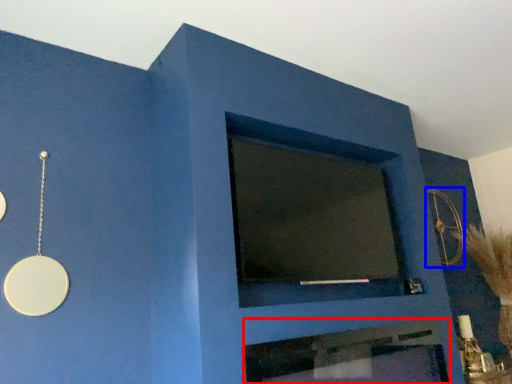
Question: Which object is closer to the camera taking this photo, fireplace (highlighted by a red box) or circle (highlighted by a blue box)?

Choices:
 (A) fireplace
 (B) circle

Answer: (A)